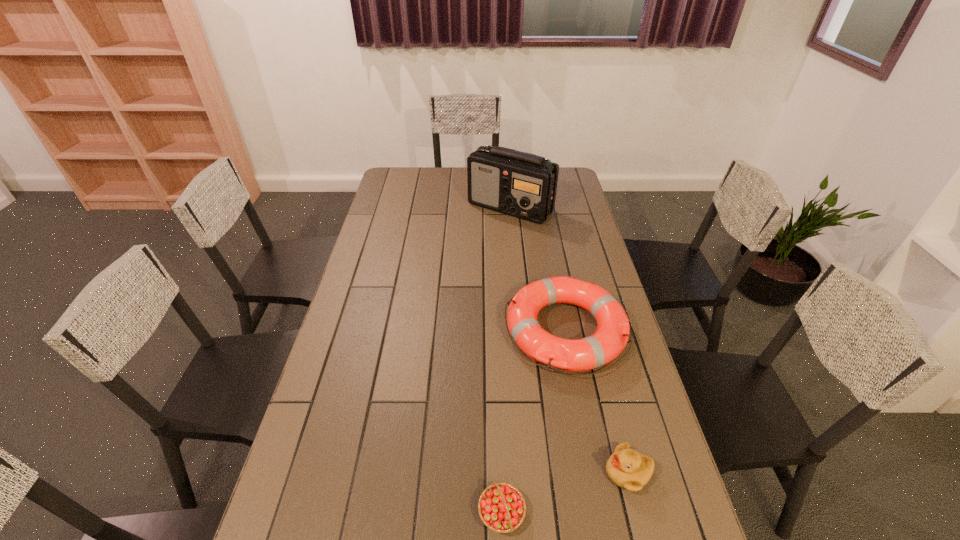
The width and height of the screenshot is (960, 540). Identify the location of vacant position located on the back of the strawberry. (498, 413).

I want to click on object that is at the far edge, so click(x=523, y=185).

Identify the location of radio receiver that is at the right edge. Image resolution: width=960 pixels, height=540 pixels. (523, 185).

Where is `life buoy that is at the right edge`? This screenshot has height=540, width=960. life buoy that is at the right edge is located at coordinates (611, 336).

Locate an element on the screen. Image resolution: width=960 pixels, height=540 pixels. duckling situated at the right edge is located at coordinates pos(628,469).

I want to click on object that is at the far right corner, so click(x=523, y=185).

Where is `free space at the far edge of the desktop`? Image resolution: width=960 pixels, height=540 pixels. free space at the far edge of the desktop is located at coordinates (459, 167).

The height and width of the screenshot is (540, 960). In the image, there is a desktop. In order to click on vacant space at the left edge in this screenshot , I will do `click(385, 330)`.

Find the location of a particular element. vacant space at the right edge of the desktop is located at coordinates (619, 423).

The width and height of the screenshot is (960, 540). In order to click on vacant area between the duckling and the strawberry in this screenshot , I will do `click(564, 492)`.